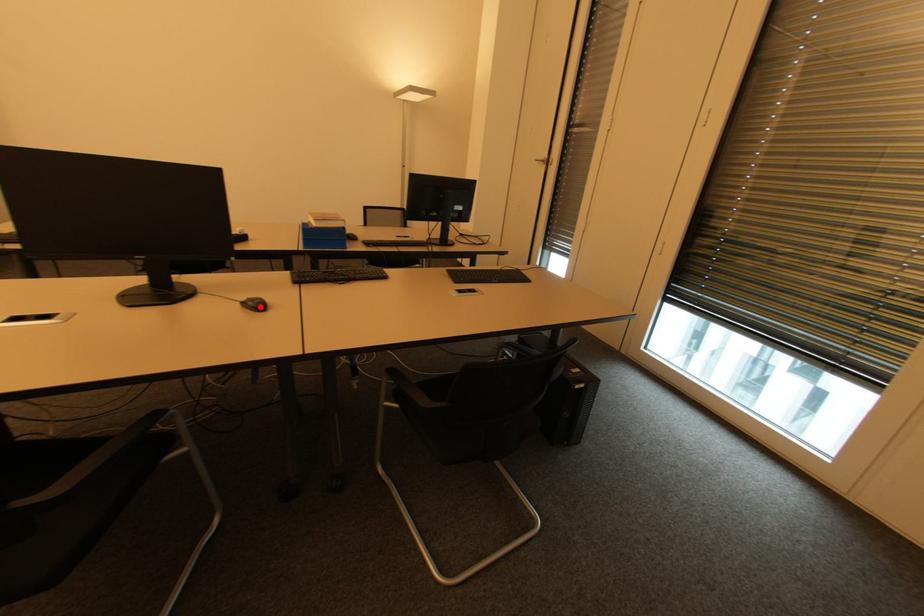
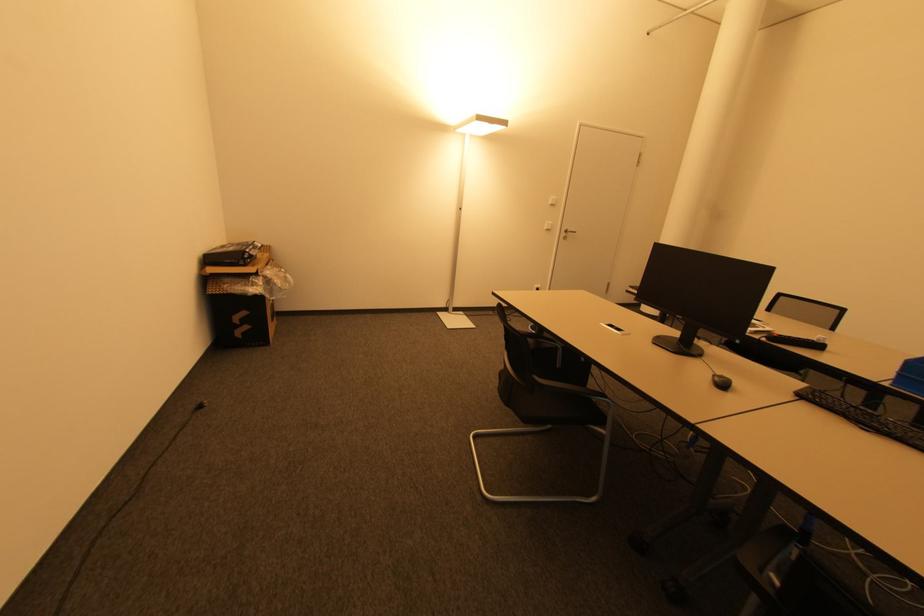
Find the pixel in the second image that matches the highlighted location in the first image.

(725, 386)